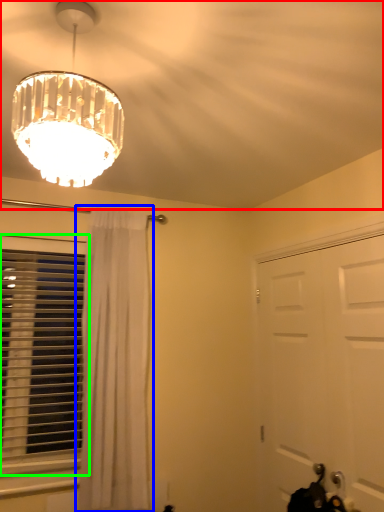
Question: Estimate the real-world distances between objects in this image. Which object is farther from fan (highlighted by a red box), curtain (highlighted by a blue box) or window (highlighted by a green box)?

Choices:
 (A) curtain
 (B) window

Answer: (B)